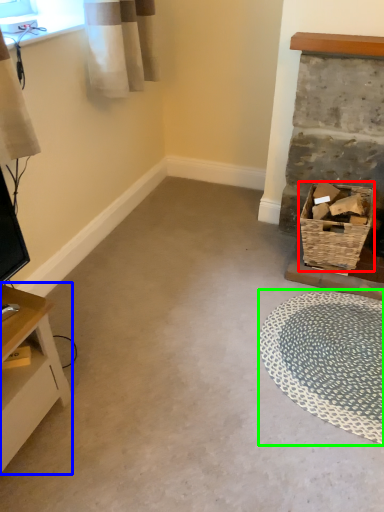
Question: Based on their relative distances, which object is farther from basket (highlighted by a red box)? Choose from table (highlighted by a blue box) and mat (highlighted by a green box).

Choices:
 (A) table
 (B) mat

Answer: (A)